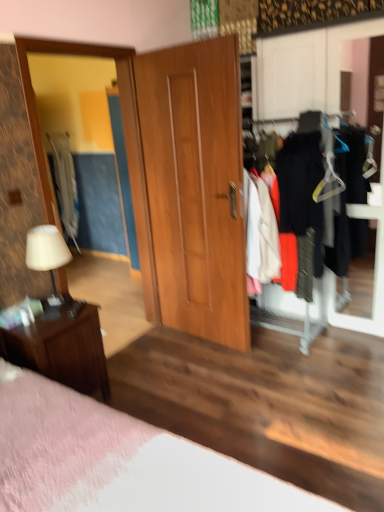
Question: From the image's perspective, would you say light gray fabric coat at left is positioned over matte wooden mirror at left?

Choices:
 (A) no
 (B) yes

Answer: (B)

Question: Does light gray fabric coat at left appear on the left side of matte wooden mirror at left?

Choices:
 (A) yes
 (B) no

Answer: (A)

Question: Can we say light gray fabric coat at left lies outside matte wooden mirror at left?

Choices:
 (A) no
 (B) yes

Answer: (B)

Question: From the image's perspective, does light gray fabric coat at left appear lower than matte wooden mirror at left?

Choices:
 (A) yes
 (B) no

Answer: (B)

Question: From a real-world perspective, is light gray fabric coat at left located higher than matte wooden mirror at left?

Choices:
 (A) no
 (B) yes

Answer: (A)

Question: Is wooden door at center inside the boundaries of yellow plastic hanger at center right, or outside?

Choices:
 (A) inside
 (B) outside

Answer: (B)

Question: From the image's perspective, is wooden door at center located above or below yellow plastic hanger at center right?

Choices:
 (A) above
 (B) below

Answer: (B)

Question: Is wooden door at center in front of or behind yellow plastic hanger at center right in the image?

Choices:
 (A) front
 (B) behind

Answer: (A)

Question: Looking at their shapes, would you say wooden door at center is wider or thinner than yellow plastic hanger at center right?

Choices:
 (A) thin
 (B) wide

Answer: (A)

Question: Is point (357, 157) positioned closer to the camera than point (71, 168)?

Choices:
 (A) closer
 (B) farther

Answer: (A)

Question: From a real-world perspective, is matte black clothes at right above or below light gray fabric coat at left?

Choices:
 (A) below
 (B) above

Answer: (B)

Question: Considering the positions of matte black clothes at right and light gray fabric coat at left in the image, is matte black clothes at right bigger or smaller than light gray fabric coat at left?

Choices:
 (A) big
 (B) small

Answer: (A)

Question: In the image, is matte black clothes at right on the left side or the right side of light gray fabric coat at left?

Choices:
 (A) right
 (B) left

Answer: (A)

Question: In the image, is light gray fabric coat at left positioned in front of or behind matte wooden mirror at left?

Choices:
 (A) behind
 (B) front

Answer: (A)

Question: Looking at their shapes, would you say light gray fabric coat at left is wider or thinner than matte wooden mirror at left?

Choices:
 (A) thin
 (B) wide

Answer: (B)